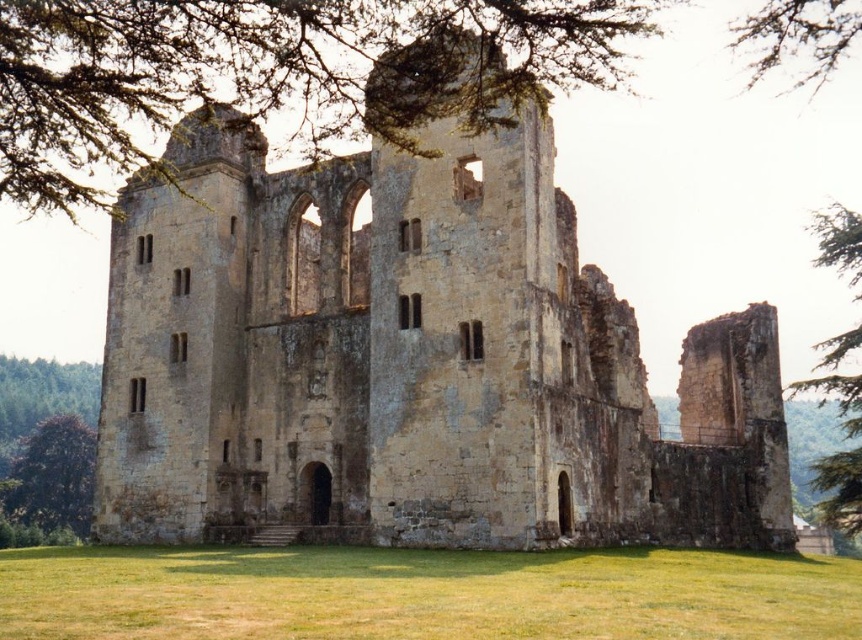
Question: Which point appears closest to the camera in this image?

Choices:
 (A) (738, 35)
 (B) (817, 342)
 (C) (458, 236)

Answer: (C)

Question: Which point appears closest to the camera in this image?

Choices:
 (A) (815, 346)
 (B) (442, 24)
 (C) (809, 28)
 (D) (514, 435)

Answer: (B)

Question: Does green leafy tree at upper left appear on the left side of green leafy tree at lower left?

Choices:
 (A) yes
 (B) no

Answer: (B)

Question: Can you confirm if green leafy tree at upper left is positioned to the left of green leafy tree at upper right?

Choices:
 (A) yes
 (B) no

Answer: (A)

Question: Is green leafy tree at upper right above green leafy tree at lower left?

Choices:
 (A) no
 (B) yes

Answer: (B)

Question: Considering the real-world distances, which object is farthest from the yellow stone ruins at center?

Choices:
 (A) green leafy tree at upper right
 (B) green leafy tree at lower left
 (C) brown textured branch at upper center
 (D) green leafy tree at upper left

Answer: (B)